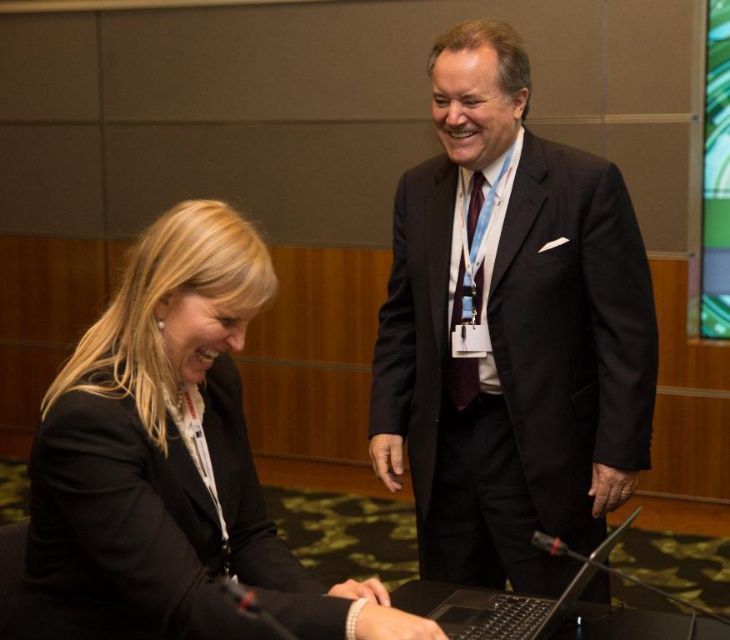
Does dark suit at center have a lesser height compared to black plastic laptop at lower center?

No, dark suit at center is not shorter than black plastic laptop at lower center.

Where is `dark suit at center`? This screenshot has width=730, height=640. dark suit at center is located at coordinates (510, 333).

Consider the image. Which of these two, black matte suit at lower left or black plastic laptop at lower center, stands taller?

With more height is black matte suit at lower left.

Does black matte suit at lower left appear over black plastic laptop at lower center?

Indeed, black matte suit at lower left is positioned over black plastic laptop at lower center.

Between point (199, 401) and point (529, 598), which one is positioned behind?

Point (529, 598)

Find the location of a particular element. Image resolution: width=730 pixels, height=640 pixels. black matte suit at lower left is located at coordinates (169, 451).

Can you confirm if dark suit at center is positioned above black matte suit at lower left?

Yes.

Is point (518, 184) closer to viewer compared to point (249, 538)?

No, it is behind (249, 538).

I want to click on dark suit at center, so click(510, 333).